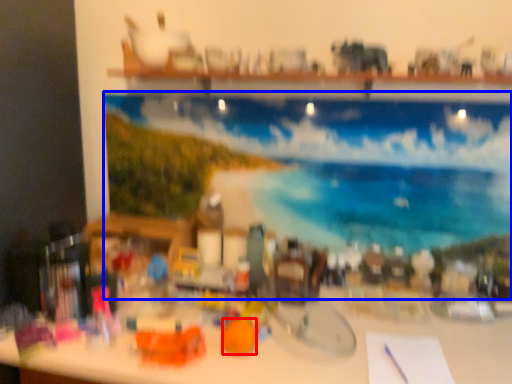
Question: Which object appears farthest to the camera in this image, toy (highlighted by a red box) or swimming pool (highlighted by a blue box)?

Choices:
 (A) toy
 (B) swimming pool

Answer: (B)